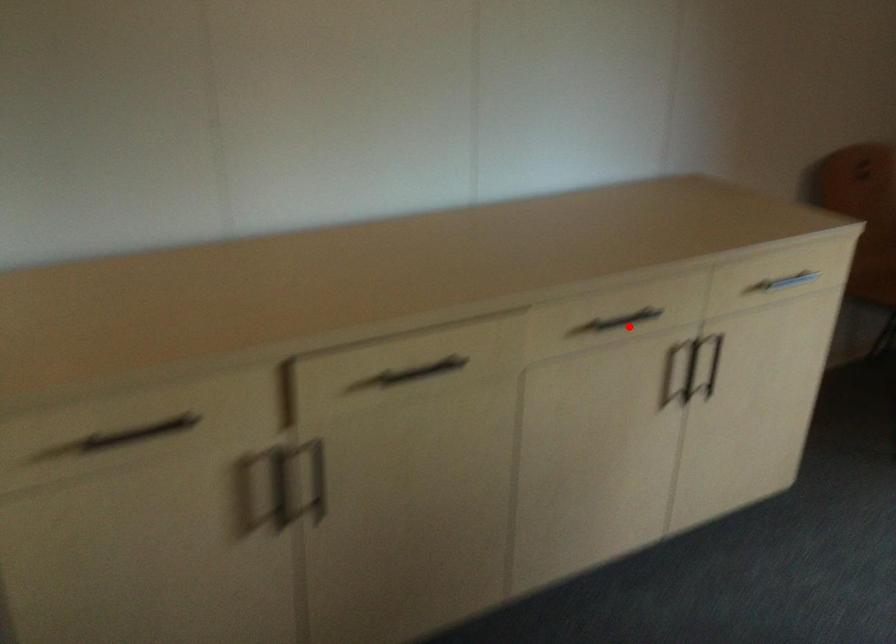
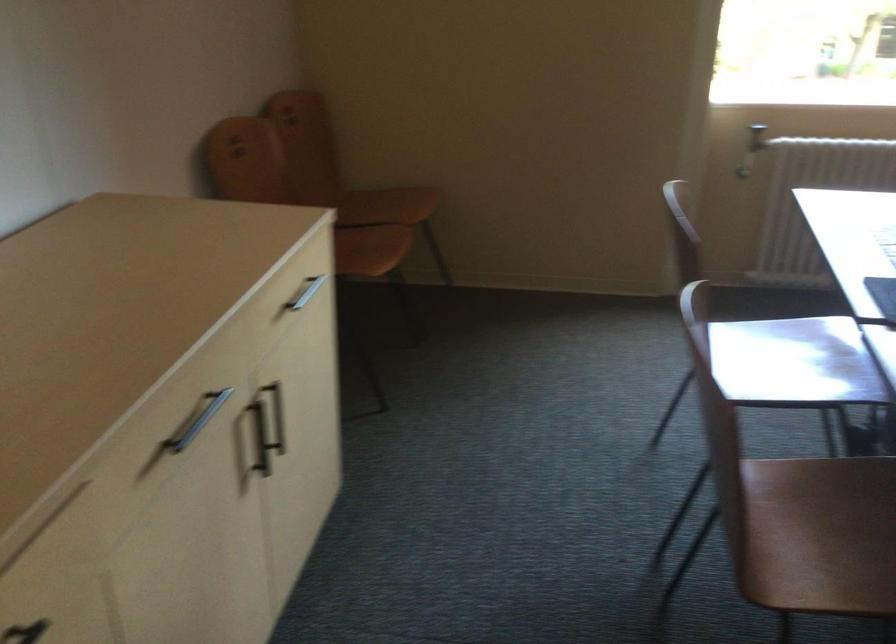
The point at the highlighted location is marked in the first image. Where is the corresponding point in the second image?

(197, 420)